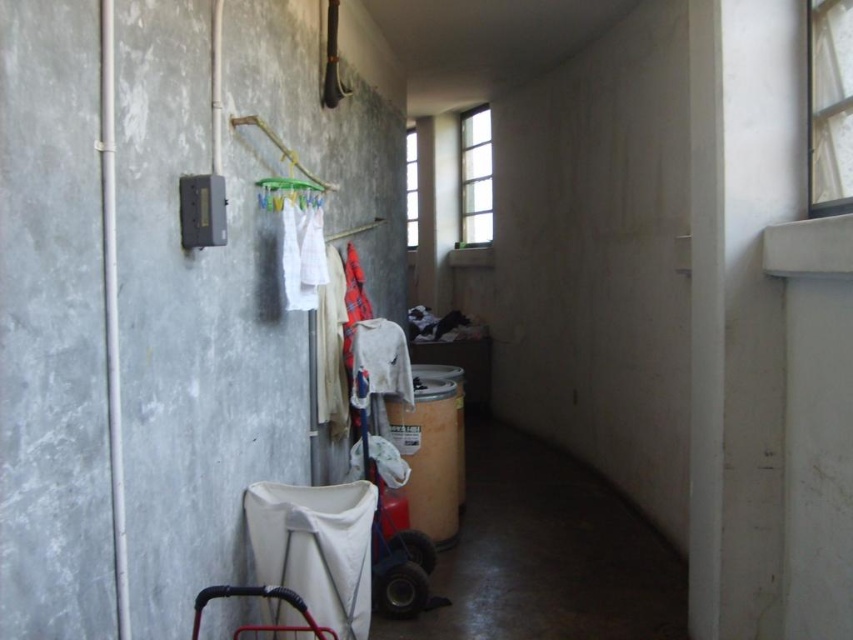
You are organizing items in the utility room and need to determine which object takes up more space. Which is larger between the white fabric at center and the metallic baby carriage at lower left?

The metallic baby carriage at lower left is larger than the white fabric at center.